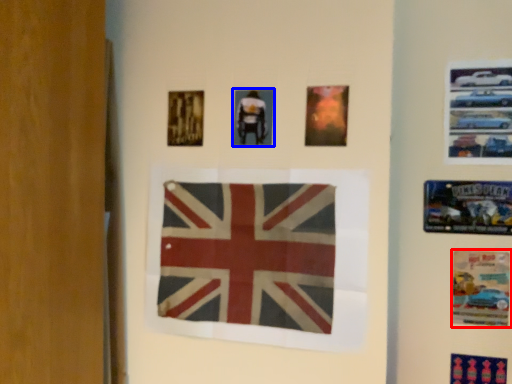
Question: Which object appears farthest to the camera in this image, poster (highlighted by a red box) or poster (highlighted by a blue box)?

Choices:
 (A) poster
 (B) poster

Answer: (A)